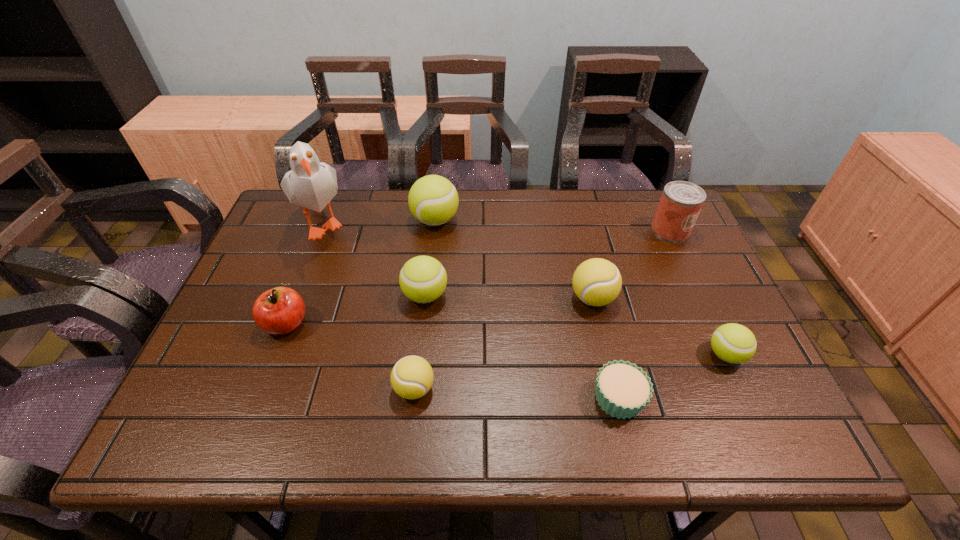
Locate an element on the screen. This screenshot has width=960, height=540. gull is located at coordinates (312, 184).

Locate an element on the screen. This screenshot has width=960, height=540. the tallest tennis ball is located at coordinates (433, 200).

Where is `the farthest tennis ball`? The height and width of the screenshot is (540, 960). the farthest tennis ball is located at coordinates (433, 200).

What are the coordinates of `can` in the screenshot? It's located at (681, 202).

At what (x,y) coordinates should I click in order to perform the action: click on the fourth tennis ball from left to right. Please return your answer as a coordinate pair (x, y). Looking at the image, I should click on (597, 282).

Image resolution: width=960 pixels, height=540 pixels. What are the coordinates of `the bigger yellow tennis ball` in the screenshot? It's located at (597, 282).

Image resolution: width=960 pixels, height=540 pixels. Find the location of `the second biggest green tennis ball`. the second biggest green tennis ball is located at coordinates (423, 279).

What are the coordinates of `red apple` in the screenshot? It's located at (278, 311).

Image resolution: width=960 pixels, height=540 pixels. Identify the location of the nearer yellow tennis ball. (412, 377).

The width and height of the screenshot is (960, 540). In order to click on the left yellow tennis ball in this screenshot , I will do 412,377.